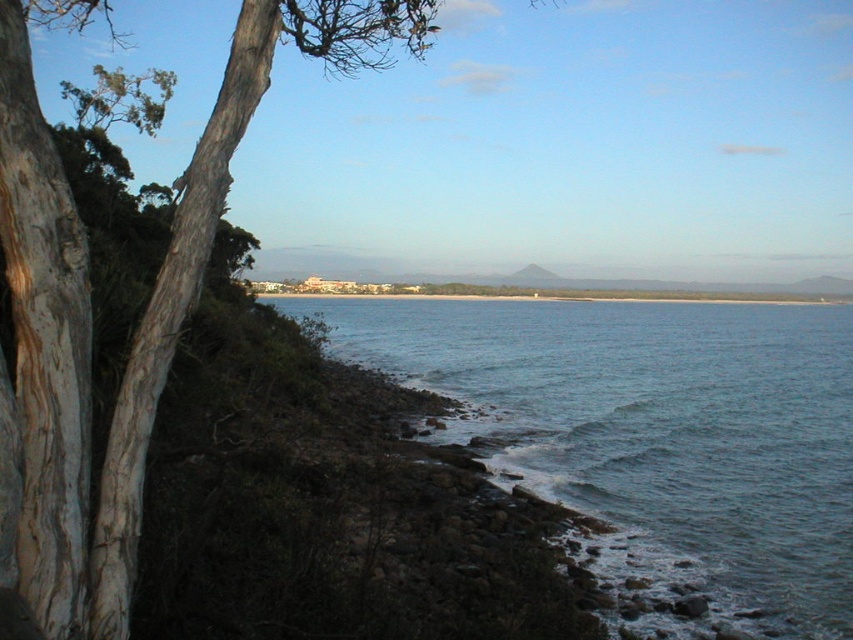
Question: Which point appears farthest from the camera in this image?

Choices:
 (A) (712, 500)
 (B) (78, 497)

Answer: (A)

Question: Is blue water at lower right behind smooth bark tree at left?

Choices:
 (A) no
 (B) yes

Answer: (B)

Question: Which object is farther from the camera taking this photo?

Choices:
 (A) blue water at lower right
 (B) smooth bark tree at left

Answer: (A)

Question: Does blue water at lower right appear on the right side of smooth bark tree at left?

Choices:
 (A) yes
 (B) no

Answer: (A)

Question: Does blue water at lower right appear under smooth bark tree at left?

Choices:
 (A) no
 (B) yes

Answer: (B)